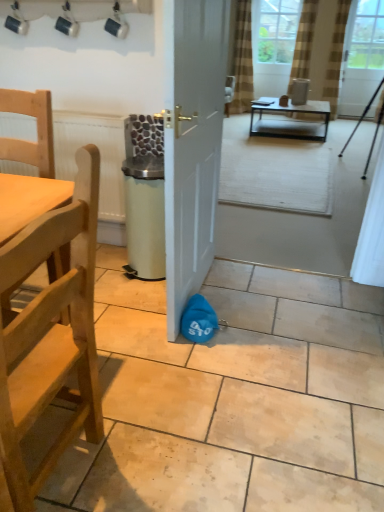
Locate an element on the screen. This screenshot has width=384, height=512. vacant region to the right of white glossy door at center is located at coordinates (234, 301).